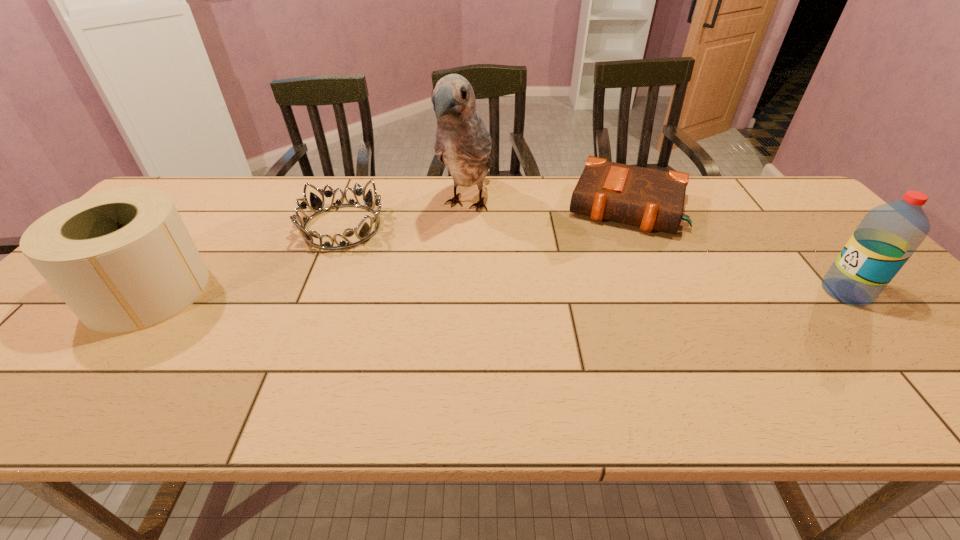
Identify the location of free space between the second object from right to left and the tiara. This screenshot has width=960, height=540. (484, 217).

At what (x,y) coordinates should I click in order to perform the action: click on free space between the rightmost object and the fourth object from left to right. Please return your answer as a coordinate pair (x, y). The image size is (960, 540). Looking at the image, I should click on (736, 249).

Find the location of `free space between the toilet tissue and the fourth object from right to left`. free space between the toilet tissue and the fourth object from right to left is located at coordinates (245, 259).

The image size is (960, 540). Identify the location of blank region between the third tallest object and the fourth object from left to right. (387, 249).

You are a GUI agent. You are given a task and a screenshot of the screen. Output one action in this format:
    pyautogui.click(x=<x>, y=<y>)
    Task: Click on the free spot between the second object from left to right and the fourth object from left to right
    The width and height of the screenshot is (960, 540).
    Given the screenshot: What is the action you would take?
    pyautogui.click(x=484, y=217)

Locate an element on the screen. Image resolution: width=960 pixels, height=540 pixels. free area in between the parrot and the second object from right to left is located at coordinates pos(546,206).

Locate an element on the screen. The image size is (960, 540). vacant area that lies between the Bible and the water bottle is located at coordinates coord(736,249).

This screenshot has height=540, width=960. Identify the location of free area in between the third object from right to left and the tiara. (404, 216).

The height and width of the screenshot is (540, 960). Identify the location of vacant area between the second object from right to left and the third shortest object. (387, 249).

The width and height of the screenshot is (960, 540). I want to click on empty space that is in between the tiara and the leftmost object, so click(245, 259).